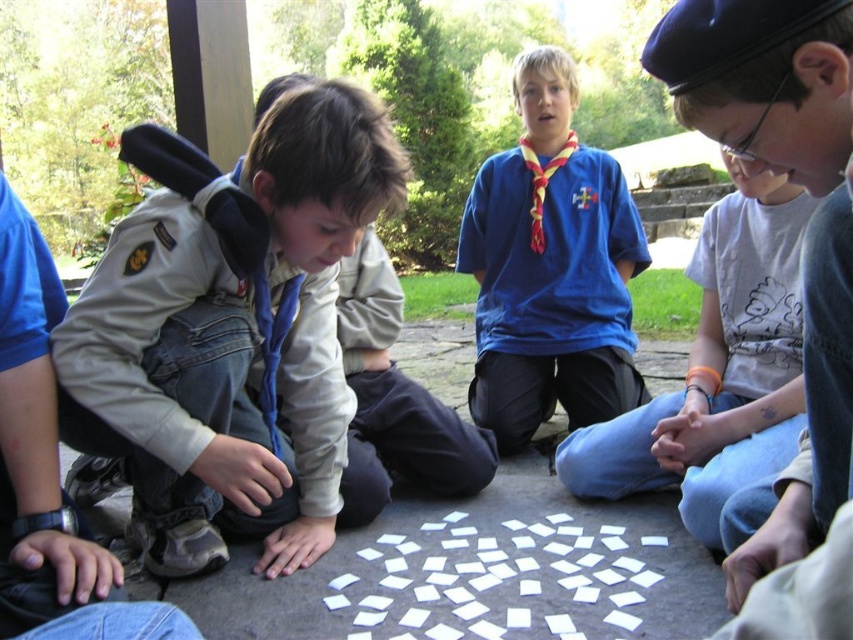
Can you confirm if khaki uniform at center is positioned below white paper at center?

No.

Is point (206, 172) closer to viewer compared to point (784, 339)?

Yes, point (206, 172) is closer to viewer.

Does point (323, 81) lie behind point (737, 205)?

No, it is in front of (737, 205).

Image resolution: width=853 pixels, height=640 pixels. Identify the location of khaki uniform at center. (230, 330).

Between white paper at center and white paper squares at center, which one appears on the right side from the viewer's perspective?

white paper at center is more to the right.

Does white paper at center appear on the right side of white paper squares at center?

Correct, you'll find white paper at center to the right of white paper squares at center.

Between point (636, 465) and point (520, 563), which one is positioned in front?

Point (520, 563)

In order to click on white paper at center in this screenshot , I will do `click(717, 369)`.

Who is higher up, blue cotton shirt at center or white paper at center?

Positioned higher is blue cotton shirt at center.

Can you confirm if blue cotton shirt at center is positioned to the right of white paper at center?

No, blue cotton shirt at center is not to the right of white paper at center.

Identify the location of blue cotton shirt at center. This screenshot has height=640, width=853. (550, 268).

This screenshot has height=640, width=853. What are the coordinates of `blue cotton shirt at center` in the screenshot? It's located at (550, 268).